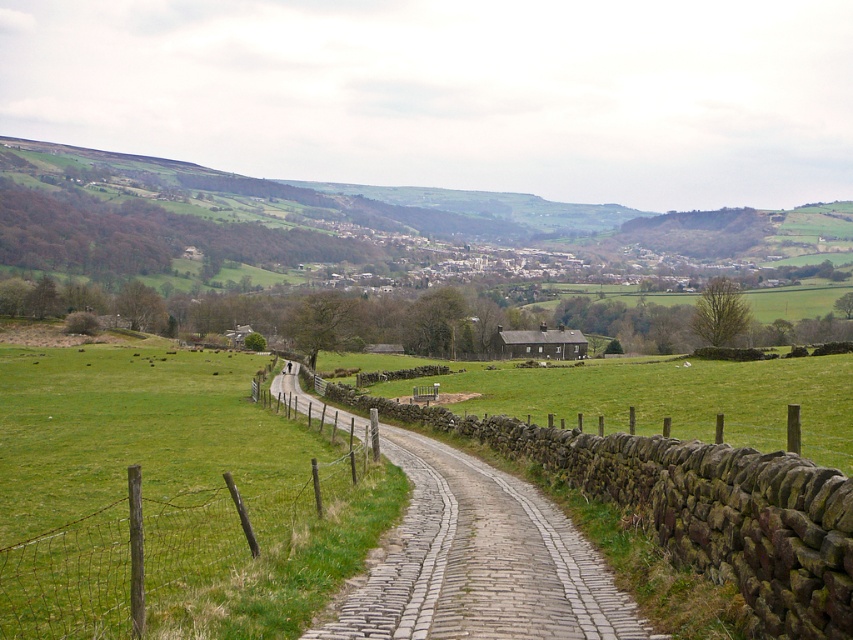
Question: Which object appears farthest from the camera in this image?

Choices:
 (A) wire mesh fence at lower left
 (B) cobblestone path at center

Answer: (B)

Question: Does cobblestone path at center appear over wire mesh fence at lower left?

Choices:
 (A) no
 (B) yes

Answer: (A)

Question: Which of the following is the farthest from the observer?

Choices:
 (A) wire mesh fence at lower left
 (B) cobblestone path at center

Answer: (B)

Question: Can you confirm if cobblestone path at center is smaller than wire mesh fence at lower left?

Choices:
 (A) yes
 (B) no

Answer: (A)

Question: Can you confirm if cobblestone path at center is positioned below wire mesh fence at lower left?

Choices:
 (A) no
 (B) yes

Answer: (B)

Question: Among these objects, which one is farthest from the camera?

Choices:
 (A) cobblestone path at center
 (B) wire mesh fence at lower left

Answer: (A)